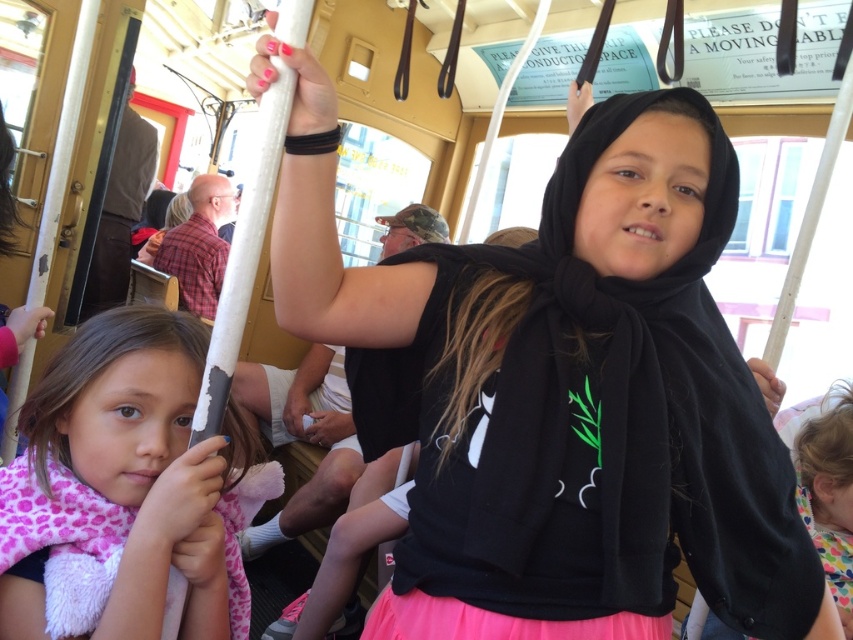
You are a tailor measuring the distance between two pieces of fabric in a vintage streetcar. The pink fabric at center is part of a girl s outfit, and the pink fabric at lower right is part of another girl s skirt. Can you fit a 0.5 inch wide ribbon between them?

The distance between the pink fabric at center and the pink fabric at lower right is 0.45 inches. Since the ribbon is 0.5 inches wide, which is slightly wider than the gap, it won t fit between them.